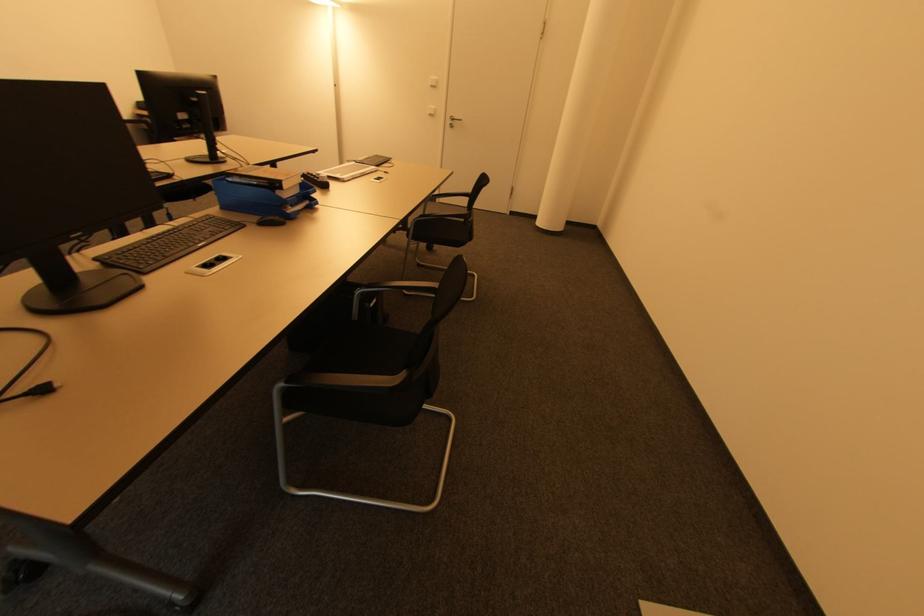
The image size is (924, 616). Identify the location of metal door handle. (454, 122).